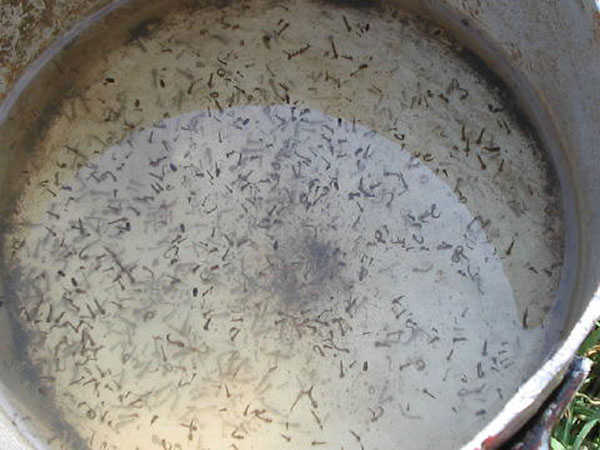
At what (x,y) coordinates should I click in order to perform the action: click on metal pan. Please return your answer as a coordinate pair (x, y). Image resolution: width=600 pixels, height=450 pixels. Looking at the image, I should click on (559, 52).